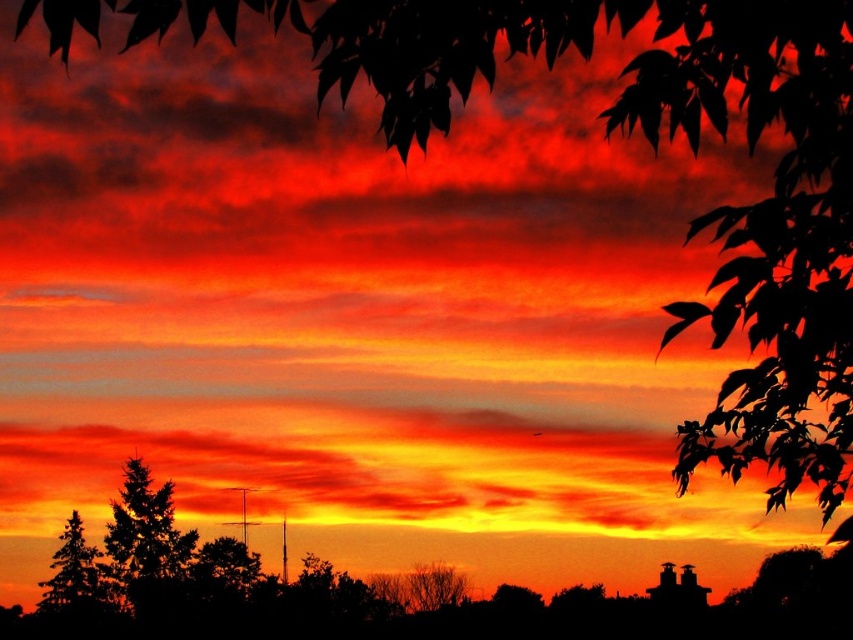
From the picture: You are an artist trying to sketch this sunset scene. You want to ensure the silhouette evergreen tree at lower left and the bare branches at lower center are proportionally accurate. Which object should you draw wider?

The bare branches at lower center should be drawn wider since the silhouette evergreen tree at lower left has a lesser width compared to bare branches at lower center.

You are a bird flying at an altitude of 15 meters above the ground. You spot the silhouette evergreen tree at lower left and the bare branches at lower center in the sunset scene. Can you safely fly between them without hitting either?

The distance between the silhouette evergreen tree at lower left and the bare branches at lower center is 13.34 meters. Since you are flying at 15 meters altitude, which is higher than the vertical distance between them, you can safely fly over the gap between them.

You are an artist sketching the sunset scene. You need to decide which object to draw first based on their sizes. Which one should you start with, the silhouette evergreen tree at lower left or the bare branches at lower center?

The silhouette evergreen tree at lower left is smaller than the bare branches at lower center. Since you want to draw the larger object first to ensure proper placement, you should start with the bare branches at lower center.